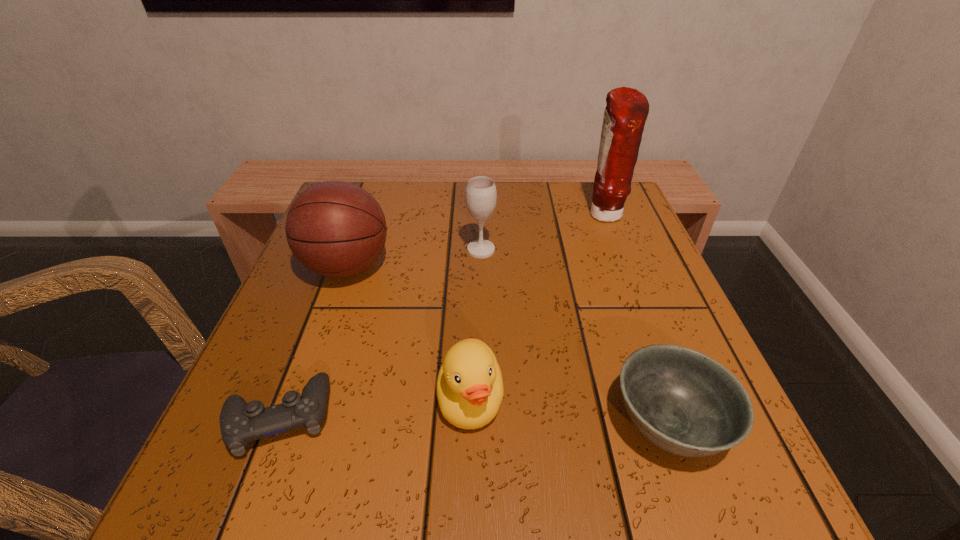
I want to click on the tallest object, so click(x=627, y=109).

The image size is (960, 540). Identify the location of condiment. (627, 109).

At what (x,y) coordinates should I click in order to perform the action: click on basketball. Please return your answer as a coordinate pair (x, y). Looking at the image, I should click on (336, 229).

Image resolution: width=960 pixels, height=540 pixels. I want to click on wineglass, so click(481, 195).

This screenshot has width=960, height=540. In order to click on the third shortest object in this screenshot , I will do `click(470, 390)`.

Identify the location of the fifth tallest object. (686, 403).

Locate an element on the screen. Image resolution: width=960 pixels, height=540 pixels. control is located at coordinates (240, 423).

You are a GUI agent. You are given a task and a screenshot of the screen. Output one action in this format:
    pyautogui.click(x=<x>, y=<y>)
    Task: Click on the blank space located 0.190m on the left of the farthest object
    This screenshot has width=960, height=540.
    Given the screenshot: What is the action you would take?
    pyautogui.click(x=508, y=215)

This screenshot has width=960, height=540. I want to click on free spot located 0.230m on the front of the basketball, so click(x=299, y=402).

Find the location of a particular element. free space located 0.170m on the back of the wineglass is located at coordinates (481, 201).